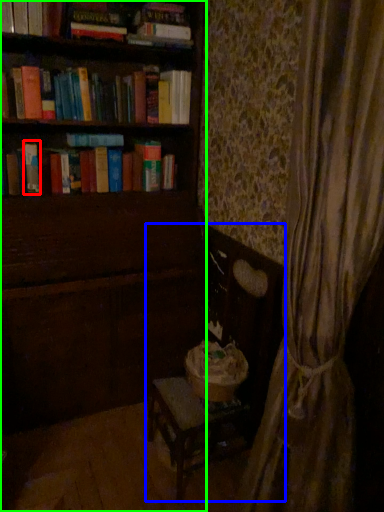
Question: Considering the real-world distances, which object is closest to paperback book (highlighted by a red box)? rocking chair (highlighted by a blue box) or furniture (highlighted by a green box).

Choices:
 (A) rocking chair
 (B) furniture

Answer: (B)